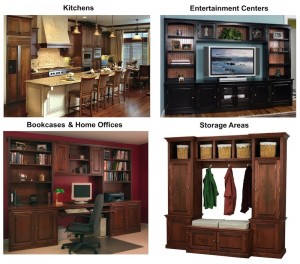
You are a GUI agent. You are given a task and a screenshot of the screen. Output one action in this format:
    pyautogui.click(x=<x>, y=<y>)
    Task: Click on the kitchens
    Image resolution: width=300 pixels, height=264 pixels.
    Given the screenshot: What is the action you would take?
    pyautogui.click(x=75, y=7)